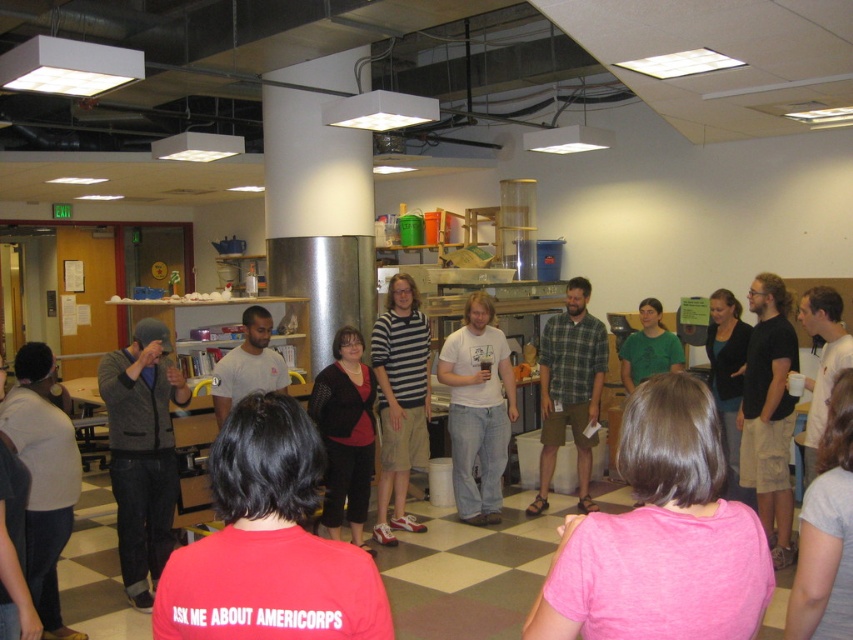
You are standing in the communal area and want to move from point A to point B. Point A is located at coordinate point (688, 628) and point B is at coordinate point (558, 349). Since you can only move forward, which point should you head towards to get closer to the person in the red shirt with the Americorps message?

Point A is closer to the viewer than point B. Therefore, to get closer to the person in the red shirt with the Americorps message, you should head towards point A since it is already closer to you.

You are at an event and see both the red matte shirt at center and the dark gray knit hat at left. Which object is positioned to the right of the other?

The red matte shirt at center is positioned to the right of the dark gray knit hat at left.